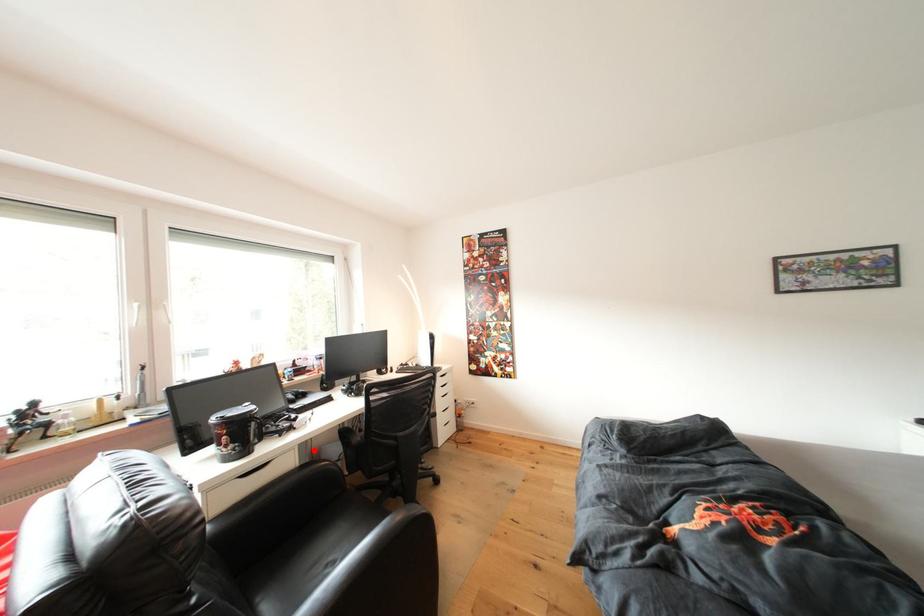
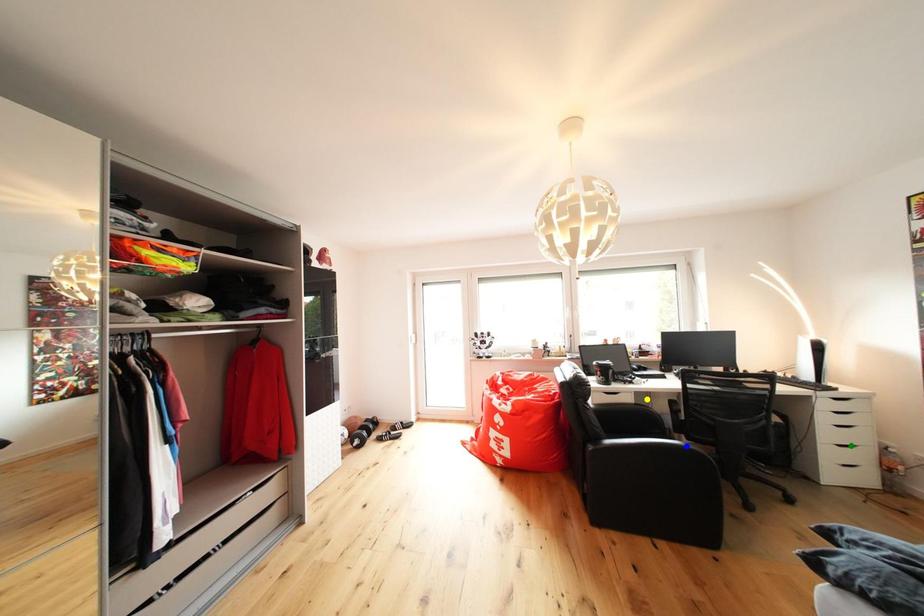
Question: I am providing you with two images of the same scene from different viewpoints. A red point is marked on the first image. You are given multiple points on the second image. Which point in image 2 represents the same 3d spot as the red point in image 1?

Choices:
 (A) yellow point
 (B) blue point
 (C) green point

Answer: (A)